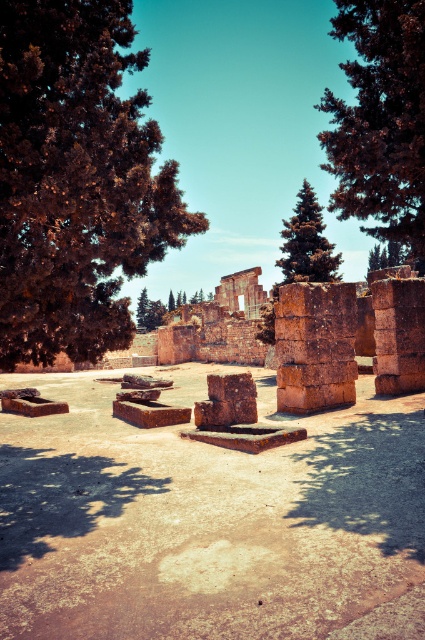
Question: Does brown textured tree at left have a larger size compared to dark green coniferous tree at center?

Choices:
 (A) yes
 (B) no

Answer: (B)

Question: Which point is closer to the camera taking this photo?

Choices:
 (A) (414, 104)
 (B) (30, 241)
 (C) (294, 234)

Answer: (B)

Question: Which of the following is the closest to the observer?

Choices:
 (A) (306, 272)
 (B) (57, 22)

Answer: (B)

Question: Does dark green textured tree at upper right have a lesser width compared to dark green coniferous tree at center?

Choices:
 (A) no
 (B) yes

Answer: (A)

Question: Considering the relative positions of dark green textured tree at upper right and dark green coniferous tree at center in the image provided, where is dark green textured tree at upper right located with respect to dark green coniferous tree at center?

Choices:
 (A) above
 (B) below

Answer: (A)

Question: Based on their relative distances, which object is farther from the dark green textured tree at upper right?

Choices:
 (A) brown textured tree at left
 (B) dark green coniferous tree at center

Answer: (B)